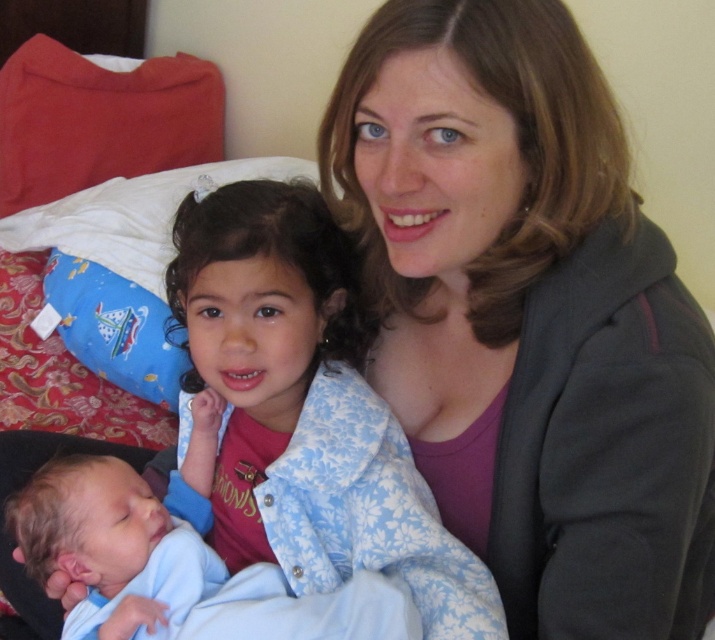
Is point (69, 467) less distant than point (69, 132)?

Yes, point (69, 467) is closer to viewer.

Can you confirm if blue soft fabric newborn at lower left is positioned below red soft pillow at upper left?

Yes.

Which is in front, point (103, 620) or point (137, 170)?

Point (103, 620) is more forward.

Identify the location of blue soft fabric newborn at lower left. (192, 573).

Measure the distance between point (556, 436) and camera.

The distance of point (556, 436) from camera is 27.33 inches.

Does matte gray hoodie at center have a greater width compared to red soft pillow at upper left?

No, matte gray hoodie at center is not wider than red soft pillow at upper left.

Does point (513, 410) come behind point (41, 77)?

No, it is not.

Find the location of a particular element. The height and width of the screenshot is (640, 715). matte gray hoodie at center is located at coordinates (528, 314).

Describe the element at coordinates (192, 573) in the screenshot. This screenshot has width=715, height=640. I see `blue soft fabric newborn at lower left` at that location.

Is point (207, 586) behind point (132, 371)?

No, (207, 586) is in front of (132, 371).

Locate an element on the screen. blue soft fabric newborn at lower left is located at coordinates (192, 573).